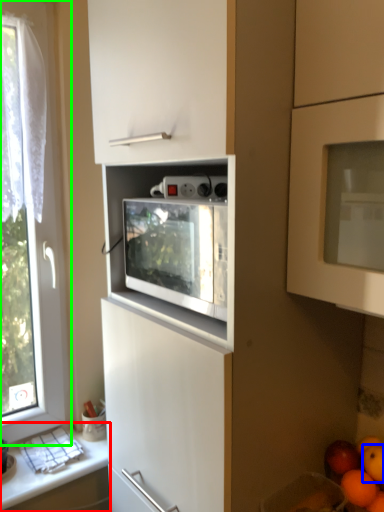
Question: Which is nearer to the countertop (highlighted by a red box)? orange (highlighted by a blue box) or window (highlighted by a green box).

Choices:
 (A) orange
 (B) window

Answer: (B)